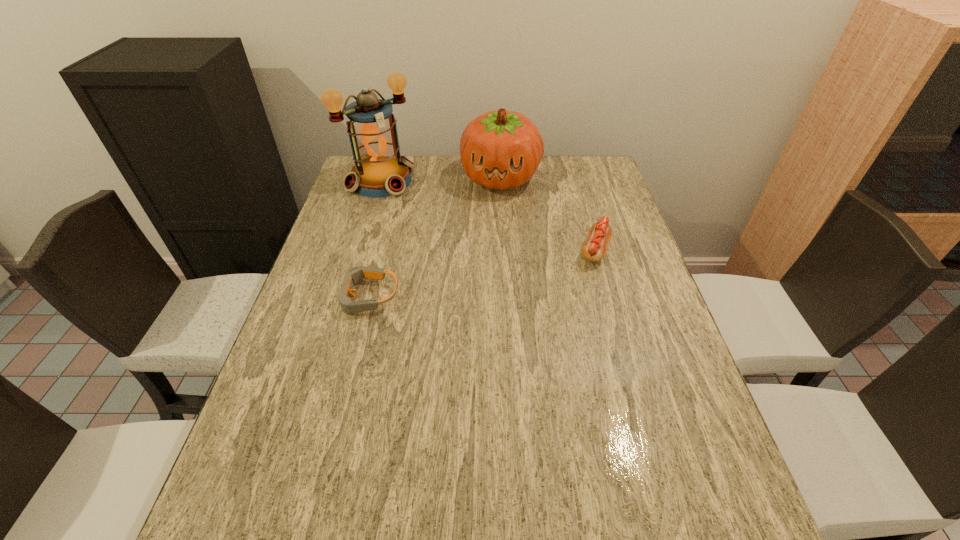
You are a GUI agent. You are given a task and a screenshot of the screen. Output one action in this format:
    pyautogui.click(x=<x>, y=<y>)
    Task: Click on the vacant area located on the left of the third tallest object
    The image size is (960, 540).
    Given the screenshot: What is the action you would take?
    pyautogui.click(x=492, y=250)

Identify the location of vacant space located on the side of the pumpkin with the cute face. (490, 225).

I want to click on free space located on the side of the pumpkin with the cute face, so click(475, 288).

Find the location of `blank space located on the side of the pumpkin with the cute face`. blank space located on the side of the pumpkin with the cute face is located at coordinates (486, 242).

At what (x,y) coordinates should I click in order to perform the action: click on vacant space positioned 0.350m on the front-facing side of the tallest object. Please return your answer as a coordinate pair (x, y). The height and width of the screenshot is (540, 960). Looking at the image, I should click on (461, 251).

This screenshot has height=540, width=960. What are the coordinates of `vacant space located 0.320m on the front-facing side of the tallest object` in the screenshot? It's located at (455, 245).

You are a GUI agent. You are given a task and a screenshot of the screen. Output one action in this format:
    pyautogui.click(x=<x>, y=<y>)
    Task: Click on the vacant space situated 0.370m on the front-facing side of the tallest object
    This screenshot has width=960, height=540.
    Given the screenshot: What is the action you would take?
    pyautogui.click(x=466, y=254)

In order to click on pumpkin present at the far edge in this screenshot , I will do `click(501, 149)`.

At what (x,y) coordinates should I click in order to perform the action: click on lantern that is at the far edge. Please return your answer as a coordinate pair (x, y). Looking at the image, I should click on (379, 171).

Image resolution: width=960 pixels, height=540 pixels. I want to click on goggles that is at the left edge, so click(355, 274).